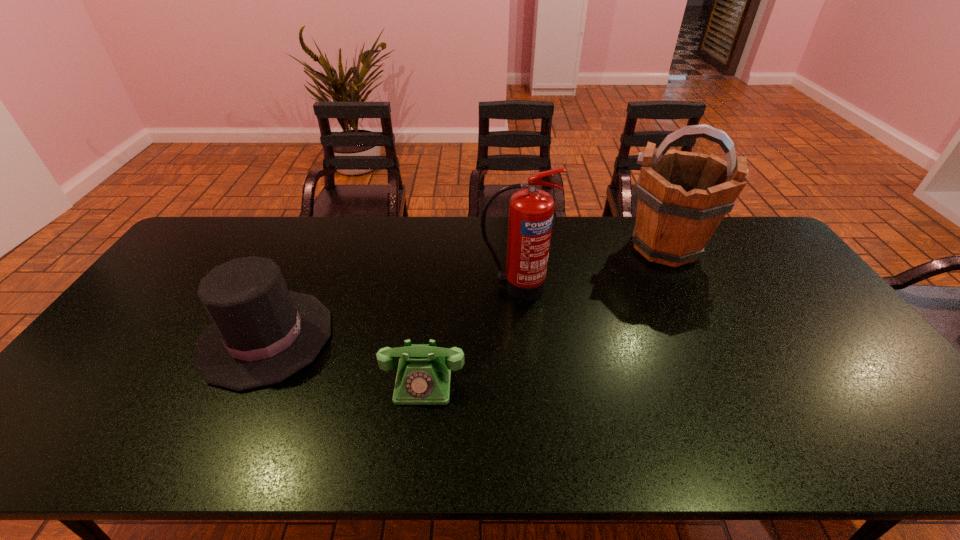
Identify the location of vacant area that lies between the rightmost object and the second shortest object. (466, 292).

Where is `free space that is in between the second shortest object and the bucket`? free space that is in between the second shortest object and the bucket is located at coordinates (466, 292).

Where is `vacant space that is in between the telephone and the second object from right to left`? This screenshot has height=540, width=960. vacant space that is in between the telephone and the second object from right to left is located at coordinates (469, 334).

Find the location of a particular element. The height and width of the screenshot is (540, 960). vacant area that lies between the dress hat and the third object from right to left is located at coordinates (345, 360).

This screenshot has width=960, height=540. In order to click on vacant space that's between the fire extinguisher and the rightmost object in this screenshot , I will do `click(590, 267)`.

The width and height of the screenshot is (960, 540). In order to click on object that stands as the second closest to the bucket in this screenshot , I will do `click(423, 377)`.

This screenshot has height=540, width=960. I want to click on object that stands as the second closest to the third object from right to left, so click(x=531, y=211).